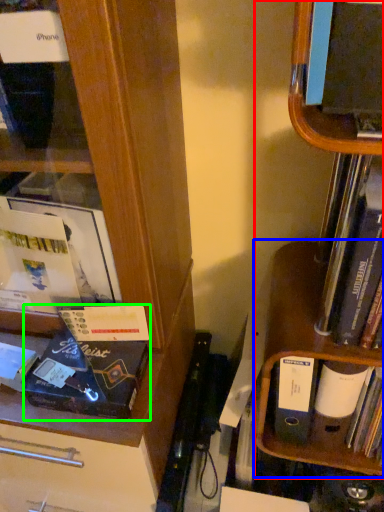
Question: Which is nearer to the shelf (highlighted by a red box)? cabinet (highlighted by a blue box) or paperback book (highlighted by a green box).

Choices:
 (A) cabinet
 (B) paperback book

Answer: (A)